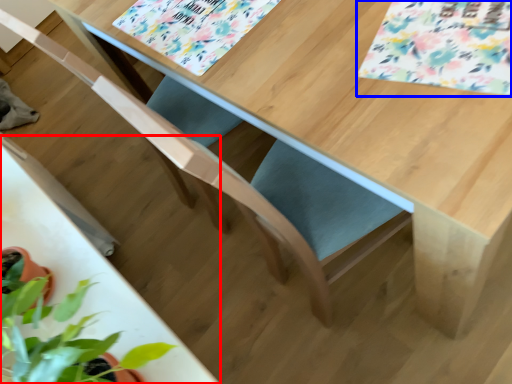
Question: Which object is further to the camera taking this photo, round table (highlighted by a red box) or flower (highlighted by a blue box)?

Choices:
 (A) round table
 (B) flower

Answer: (B)